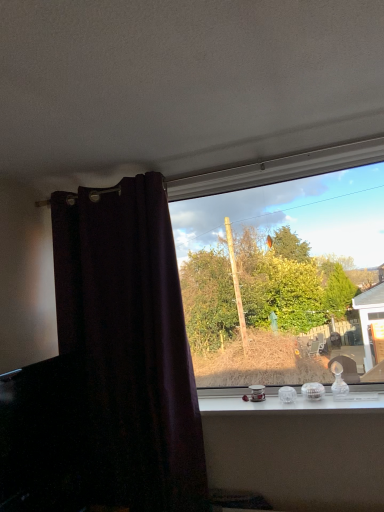
This screenshot has width=384, height=512. What do you see at coordinates (289, 403) in the screenshot?
I see `clear glass ornaments at center` at bounding box center [289, 403].

At what (x,y) coordinates should I click in order to perform the action: click on dark purple velvet curtain at left. Please return your answer as a coordinate pair (x, y). Looking at the image, I should click on (130, 342).

You are a GUI agent. You are given a task and a screenshot of the screen. Output one action in this format:
    pyautogui.click(x=<x>, y=<y>)
    Task: Click on the clear glass ornaments at center
    The image size is (384, 512).
    Given the screenshot: What is the action you would take?
    pyautogui.click(x=289, y=403)

How far apart are dark purple velvet curtain at left and transparent glass window at center?

The distance of dark purple velvet curtain at left from transparent glass window at center is 25.64 inches.

From a real-world perspective, relative to transparent glass window at center, is dark purple velvet curtain at left vertically above or below?

Clearly, from a real-world perspective, dark purple velvet curtain at left is below transparent glass window at center.

From the image's perspective, between dark purple velvet curtain at left and transparent glass window at center, which one is located above?

transparent glass window at center.

Which is correct: dark purple velvet curtain at left is inside transparent glass window at center, or outside of it?

The correct answer is: outside.

Is clear glass ornaments at center touching transparent glass window at center?

They are not placed beside each other.

From a real-world perspective, which object stands above the other?

In real-world perspective, transparent glass window at center is above.

Considering the sizes of clear glass ornaments at center and transparent glass window at center in the image, is clear glass ornaments at center taller or shorter than transparent glass window at center?

In the image, clear glass ornaments at center appears to be shorter than transparent glass window at center.

Is dark purple velvet curtain at left not inside clear glass ornaments at center?

Absolutely, dark purple velvet curtain at left is external to clear glass ornaments at center.

You are a GUI agent. You are given a task and a screenshot of the screen. Output one action in this format:
    pyautogui.click(x=<x>, y=<y>)
    Task: Click on the window sill below the dark purple velvet curtain at left (from the image's perspective)
    
    Given the screenshot: What is the action you would take?
    pyautogui.click(x=289, y=403)

Can you confirm if dark purple velvet curtain at left is smaller than clear glass ornaments at center?

No, dark purple velvet curtain at left is not smaller than clear glass ornaments at center.

Between point (106, 193) and point (327, 400), which one is positioned in front?

Positioned in front is point (327, 400).

Is transparent glass window at center positioned in front of dark purple velvet curtain at left?

No, it is behind dark purple velvet curtain at left.

Can you confirm if transparent glass window at center is shorter than dark purple velvet curtain at left?

Yes, transparent glass window at center is shorter than dark purple velvet curtain at left.

Considering the relative sizes of transparent glass window at center and clear glass ornaments at center in the image provided, is transparent glass window at center shorter than clear glass ornaments at center?

No.

Choose the correct answer: Is transparent glass window at center inside clear glass ornaments at center or outside it?

transparent glass window at center cannot be found inside clear glass ornaments at center.

Is the depth of transparent glass window at center less than that of clear glass ornaments at center?

No, transparent glass window at center is behind clear glass ornaments at center.

From a real-world perspective, who is located higher, transparent glass window at center or clear glass ornaments at center?

transparent glass window at center is physically above.

Which object is closer to the camera taking this photo, clear glass ornaments at center or dark purple velvet curtain at left?

clear glass ornaments at center is in front.

Can you confirm if clear glass ornaments at center is wider than dark purple velvet curtain at left?

Indeed, clear glass ornaments at center has a greater width compared to dark purple velvet curtain at left.

From the image's perspective, is clear glass ornaments at center located above or below dark purple velvet curtain at left?

Clearly, from the image's perspective, clear glass ornaments at center is below dark purple velvet curtain at left.

Locate an element on the screen. window above the dark purple velvet curtain at left (from a real-world perspective) is located at coordinates (283, 266).

Identify the location of window on the right of clear glass ornaments at center. (283, 266).

Estimate the real-world distances between objects in this image. Which object is further from dark purple velvet curtain at left, clear glass ornaments at center or transparent glass window at center?

Based on the image, transparent glass window at center appears to be further to dark purple velvet curtain at left.

When comparing their distances from clear glass ornaments at center, does transparent glass window at center or dark purple velvet curtain at left seem closer?

The object closer to clear glass ornaments at center is dark purple velvet curtain at left.

When comparing their distances from dark purple velvet curtain at left, does transparent glass window at center or clear glass ornaments at center seem closer?

The object closer to dark purple velvet curtain at left is clear glass ornaments at center.

Based on their spatial positions, is dark purple velvet curtain at left or transparent glass window at center further from clear glass ornaments at center?

Among the two, transparent glass window at center is located further to clear glass ornaments at center.

Estimate the real-world distances between objects in this image. Which object is closer to transparent glass window at center, clear glass ornaments at center or dark purple velvet curtain at left?

clear glass ornaments at center is closer to transparent glass window at center.

From the image, which object appears to be farther from transparent glass window at center, dark purple velvet curtain at left or clear glass ornaments at center?

dark purple velvet curtain at left lies further to transparent glass window at center than the other object.

This screenshot has height=512, width=384. Find the location of `window sill situated between dark purple velvet curtain at left and transparent glass window at center from left to right`. window sill situated between dark purple velvet curtain at left and transparent glass window at center from left to right is located at coordinates (289, 403).